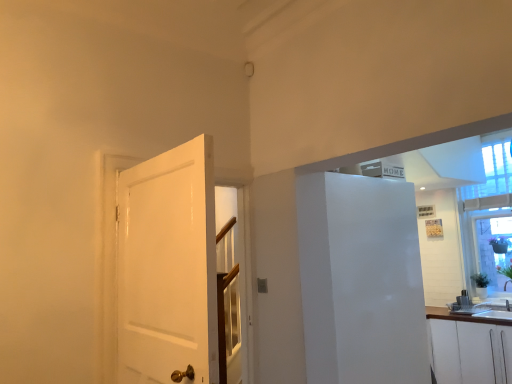
Question: Could you tell me if white matte cabinet at lower right is turned towards white glossy refrigerator at right?

Choices:
 (A) no
 (B) yes

Answer: (B)

Question: Is white matte cabinet at lower right taller than white glossy refrigerator at right?

Choices:
 (A) yes
 (B) no

Answer: (B)

Question: Is white matte cabinet at lower right bigger than white glossy refrigerator at right?

Choices:
 (A) no
 (B) yes

Answer: (B)

Question: From a real-world perspective, is white matte cabinet at lower right over white glossy refrigerator at right?

Choices:
 (A) yes
 (B) no

Answer: (B)

Question: Can you confirm if white matte cabinet at lower right is thinner than white glossy refrigerator at right?

Choices:
 (A) no
 (B) yes

Answer: (A)

Question: From a real-world perspective, is white matte cabinet at lower right below white glossy refrigerator at right?

Choices:
 (A) no
 (B) yes

Answer: (B)

Question: Is white matte cabinet at lower right to the left of white glossy door at left from the viewer's perspective?

Choices:
 (A) no
 (B) yes

Answer: (A)

Question: Is white matte cabinet at lower right oriented towards white glossy door at left?

Choices:
 (A) no
 (B) yes

Answer: (B)

Question: Can you confirm if white matte cabinet at lower right is bigger than white glossy door at left?

Choices:
 (A) no
 (B) yes

Answer: (B)

Question: Does white matte cabinet at lower right have a greater width compared to white glossy door at left?

Choices:
 (A) yes
 (B) no

Answer: (A)

Question: Can you confirm if white matte cabinet at lower right is thinner than white glossy door at left?

Choices:
 (A) yes
 (B) no

Answer: (B)

Question: Is white matte cabinet at lower right behind white glossy door at left?

Choices:
 (A) yes
 (B) no

Answer: (A)

Question: From the image's perspective, is white glossy refrigerator at right on transparent glass window at upper right?

Choices:
 (A) no
 (B) yes

Answer: (A)